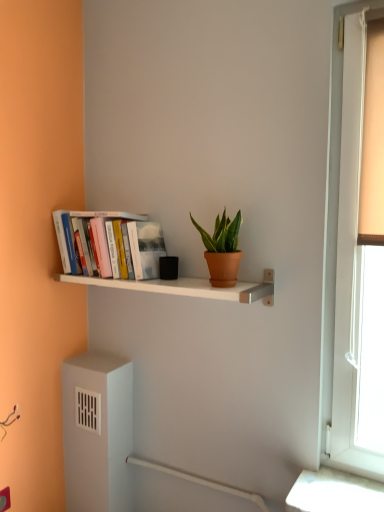
At what (x,y) coordinates should I click in order to perform the action: click on free space that is in between terracotta clay pot at center and hardcover books at left. Please return your answer as a coordinate pair (x, y). Looking at the image, I should click on (177, 281).